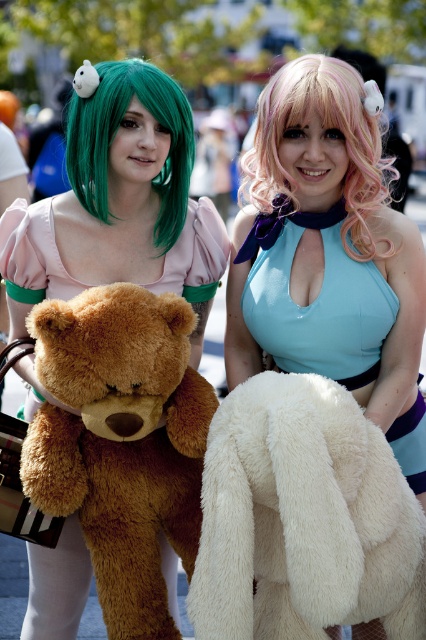
You are a photographer at a cosplay event. You need to capture a photo of the brown plush teddy bear at left and the green matte wig at upper left. If your camera can focus on objects within 5 feet of each other, will both subjects be in focus?

The distance between the brown plush teddy bear at left and the green matte wig at upper left is 4.59 feet, which is within the 5 feet range. Therefore, both subjects will be in focus.

You are a photographer at a cosplay event. You need to capture a photo of the brown plush teddy bear at left and the green matte wig at upper left. Which object is wider when viewed from your position?

The brown plush teddy bear at left is wider than the green matte wig at upper left.

In the scene shown: You are a photographer at a cosplay event. You need to capture a photo that shows both the brown plush teddy bear at left and the green matte wig at upper left. Which object should you adjust your camera angle to focus on first to ensure both are in frame?

The brown plush teddy bear at left is located below the green matte wig at upper left. To ensure both are in frame, adjust your camera angle to focus on the green matte wig at upper left first, as it is higher up, allowing the teddy bear to be captured lower in the frame.